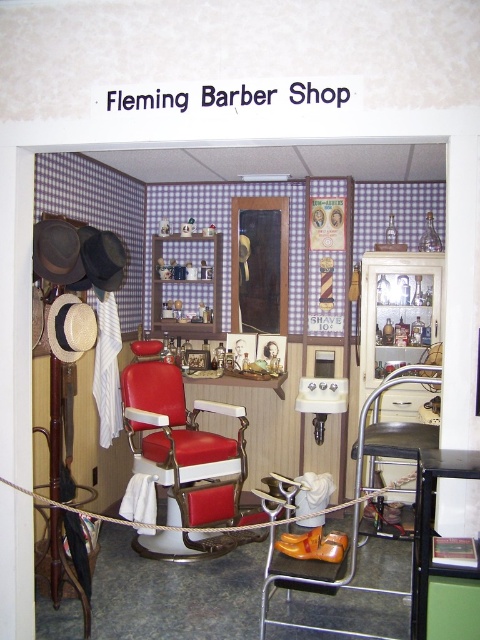
Between matte red barber chair at center and black leather stool at center, which one is positioned lower?

matte red barber chair at center is lower down.

Between matte red barber chair at center and black leather stool at center, which one appears on the left side from the viewer's perspective?

matte red barber chair at center

What are the coordinates of `matte red barber chair at center` in the screenshot? It's located at (183, 445).

Where is `matte red barber chair at center`? matte red barber chair at center is located at coordinates (183, 445).